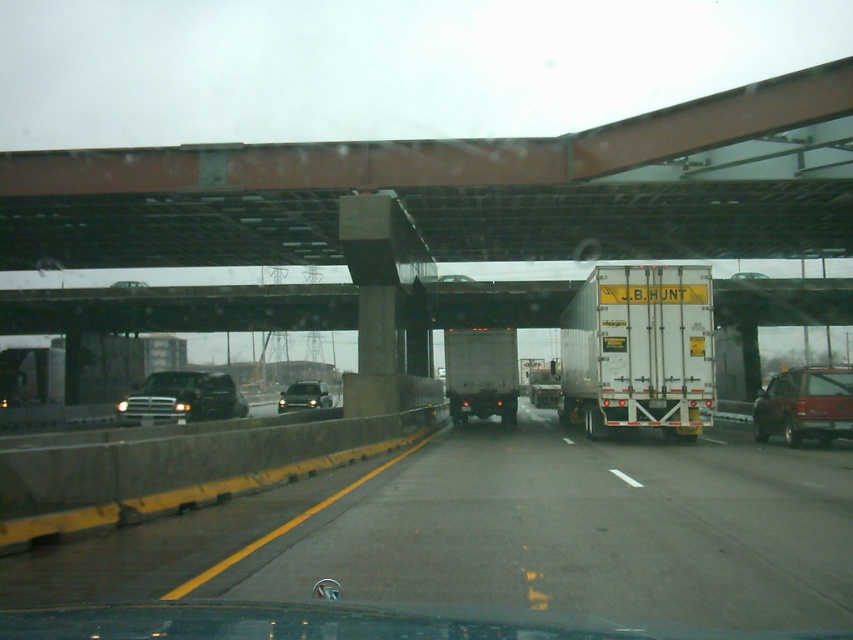
Question: Does smooth asphalt highway at center have a lesser width compared to white matte trailer truck at center?

Choices:
 (A) no
 (B) yes

Answer: (A)

Question: Does smooth asphalt highway at center appear over matte black truck at left?

Choices:
 (A) yes
 (B) no

Answer: (A)

Question: Among these objects, which one is farthest from the camera?

Choices:
 (A) smooth asphalt highway at center
 (B) white matte trailer truck at center

Answer: (B)

Question: Which is farther from the matte black suv at center?

Choices:
 (A) matte red suv at right
 (B) matte gray truck at center
 (C) matte black truck at left

Answer: (A)

Question: Among these objects, which one is farthest from the camera?

Choices:
 (A) smooth asphalt highway at center
 (B) matte gray truck at center

Answer: (B)

Question: Does smooth asphalt highway at center have a greater width compared to matte red suv at right?

Choices:
 (A) yes
 (B) no

Answer: (A)